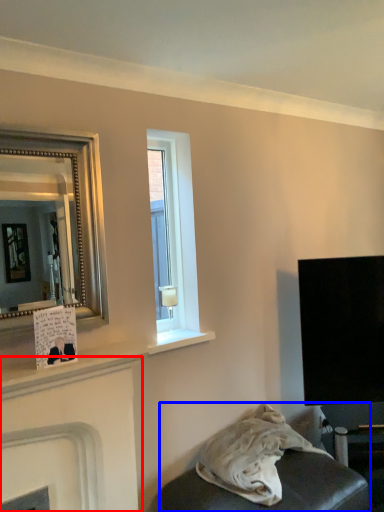
Question: Which object appears closest to the camera in this image, fireplace (highlighted by a red box) or furniture (highlighted by a blue box)?

Choices:
 (A) fireplace
 (B) furniture

Answer: (A)